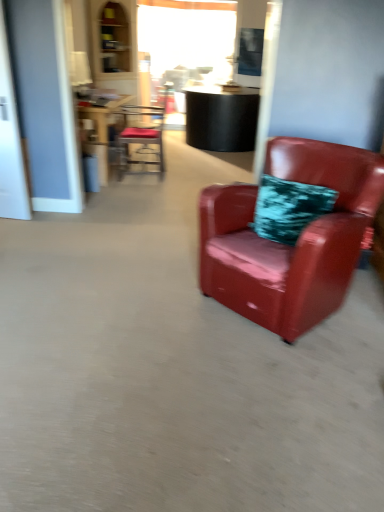
Question: Do you think glossy leather armchair at right, the second chair in the back-to-front sequence, is within metallic red chair at upper center, which ranks as the 1th chair in top-to-bottom order, or outside of it?

Choices:
 (A) inside
 (B) outside

Answer: (B)

Question: Considering their positions, is glossy leather armchair at right, acting as the 1th chair starting from the front, located in front of or behind metallic red chair at upper center, the second chair from the bottom?

Choices:
 (A) behind
 (B) front

Answer: (B)

Question: Which object is positioned farthest from the transparent glass door at left?

Choices:
 (A) metallic red chair at upper center, which ranks as the 1th chair in top-to-bottom order
 (B) wooden table at center
 (C) glossy leather armchair at right, which is the 2th chair in left-to-right order

Answer: (C)

Question: Considering the real-world distances, which object is farthest from the transparent glass door at left?

Choices:
 (A) glossy leather armchair at right, the second chair in the back-to-front sequence
 (B) wooden table at center
 (C) metallic red chair at upper center, which is counted as the second chair, starting from the front

Answer: (A)